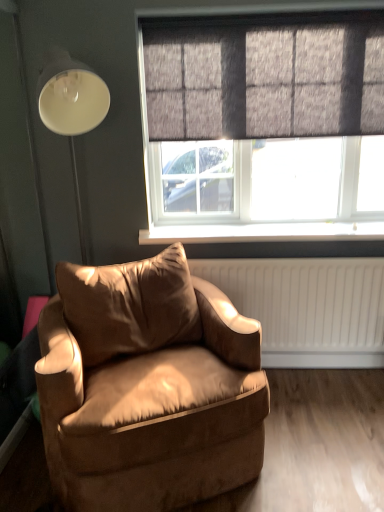
Question: Is textured gray window at upper center positioned beyond the bounds of dark grey textured curtain at upper center?

Choices:
 (A) yes
 (B) no

Answer: (A)

Question: Is textured gray window at upper center far away from dark grey textured curtain at upper center?

Choices:
 (A) yes
 (B) no

Answer: (B)

Question: Does textured gray window at upper center have a greater height compared to dark grey textured curtain at upper center?

Choices:
 (A) no
 (B) yes

Answer: (B)

Question: Is textured gray window at upper center bigger than dark grey textured curtain at upper center?

Choices:
 (A) yes
 (B) no

Answer: (A)

Question: Does textured gray window at upper center have a lesser height compared to dark grey textured curtain at upper center?

Choices:
 (A) no
 (B) yes

Answer: (A)

Question: In terms of height, does suede-like brown armchair at lower left look taller or shorter compared to textured gray window at upper center?

Choices:
 (A) short
 (B) tall

Answer: (A)

Question: Is suede-like brown armchair at lower left inside the boundaries of textured gray window at upper center, or outside?

Choices:
 (A) inside
 (B) outside

Answer: (B)

Question: From the image's perspective, is suede-like brown armchair at lower left above or below textured gray window at upper center?

Choices:
 (A) above
 (B) below

Answer: (B)

Question: Is suede-like brown armchair at lower left bigger or smaller than textured gray window at upper center?

Choices:
 (A) small
 (B) big

Answer: (B)

Question: From the image's perspective, is white plastic window sill at center positioned above or below suede-like brown armchair at lower left?

Choices:
 (A) above
 (B) below

Answer: (A)

Question: From a real-world perspective, relative to suede-like brown armchair at lower left, is white plastic window sill at center vertically above or below?

Choices:
 (A) above
 (B) below

Answer: (A)

Question: Would you say white plastic window sill at center is to the left or to the right of suede-like brown armchair at lower left in the picture?

Choices:
 (A) right
 (B) left

Answer: (A)

Question: In the image, is white plastic window sill at center positioned in front of or behind suede-like brown armchair at lower left?

Choices:
 (A) behind
 (B) front

Answer: (A)

Question: Do you think suede-like brown armchair at lower left is within dark grey textured curtain at upper center, or outside of it?

Choices:
 (A) inside
 (B) outside

Answer: (B)

Question: Considering the positions of suede-like brown armchair at lower left and dark grey textured curtain at upper center in the image, is suede-like brown armchair at lower left wider or thinner than dark grey textured curtain at upper center?

Choices:
 (A) thin
 (B) wide

Answer: (B)